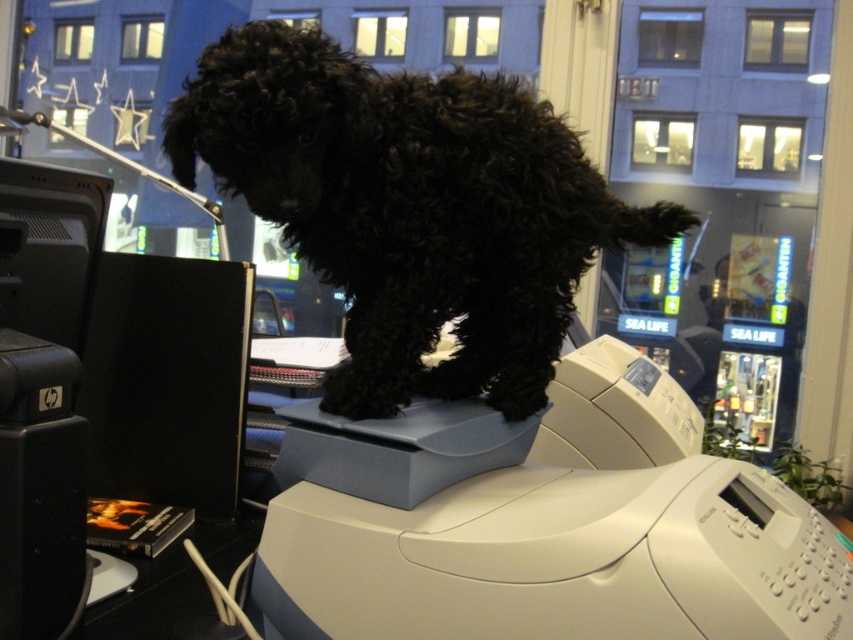
Who is higher up, black curly fur dog at center or white plastic printer at upper center?

black curly fur dog at center

Locate an element on the screen. Image resolution: width=853 pixels, height=640 pixels. black curly fur dog at center is located at coordinates (413, 200).

The image size is (853, 640). Find the location of `black curly fur dog at center`. black curly fur dog at center is located at coordinates (413, 200).

Based on the photo, who is shorter, black curly fur dog at center or black fuzzy paw at center?

With less height is black fuzzy paw at center.

Where is `black curly fur dog at center`? The image size is (853, 640). black curly fur dog at center is located at coordinates coord(413,200).

Between point (672, 486) and point (410, 371), which one is positioned in front?

Point (672, 486)

Does white plastic printer at upper center have a greater height compared to black fuzzy paw at center?

Yes, white plastic printer at upper center is taller than black fuzzy paw at center.

Is point (785, 570) closer to camera compared to point (349, 362)?

Yes, point (785, 570) is in front of point (349, 362).

Locate an element on the screen. The image size is (853, 640). white plastic printer at upper center is located at coordinates [x=563, y=540].